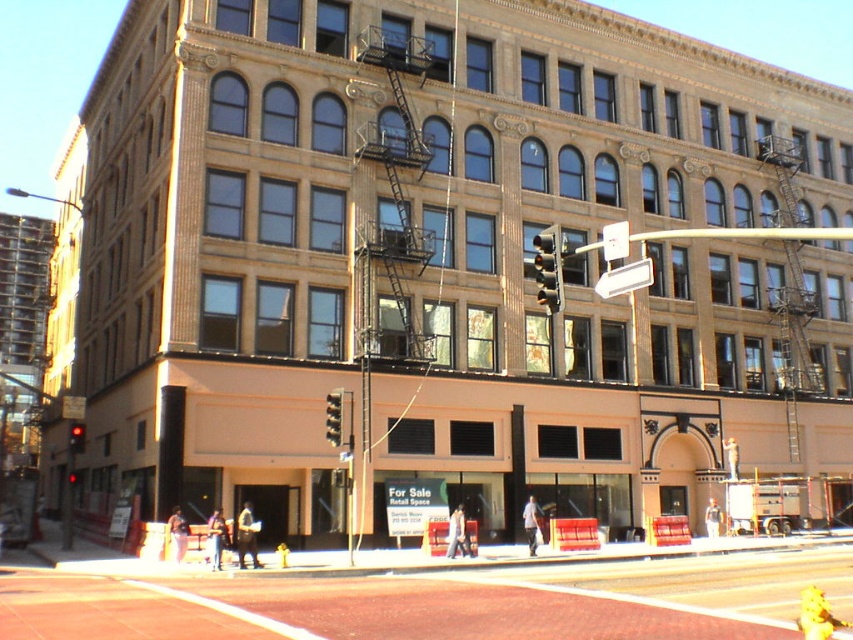
Is metallic glass traffic light at center below white plastic street sign at upper center?

Incorrect, metallic glass traffic light at center is not positioned below white plastic street sign at upper center.

At what (x,y) coordinates should I click in order to perform the action: click on metallic glass traffic light at center. Please return your answer as a coordinate pair (x, y). The width and height of the screenshot is (853, 640). Looking at the image, I should click on (548, 268).

Where is `metallic glass traffic light at center`? The width and height of the screenshot is (853, 640). metallic glass traffic light at center is located at coordinates (548, 268).

Does white plastic street sign at upper center appear on the right side of red glass traffic light at center?

Indeed, white plastic street sign at upper center is positioned on the right side of red glass traffic light at center.

Between point (637, 285) and point (80, 444), which one is positioned in front?

Point (637, 285)

Image resolution: width=853 pixels, height=640 pixels. I want to click on white plastic street sign at upper center, so click(x=625, y=278).

Is white plastic street sign at upper center taller than metallic traffic light at center?

Indeed, white plastic street sign at upper center has a greater height compared to metallic traffic light at center.

Between white plastic street sign at upper center and metallic traffic light at center, which one appears on the left side from the viewer's perspective?

From the viewer's perspective, metallic traffic light at center appears more on the left side.

Locate an element on the screen. white plastic street sign at upper center is located at coordinates (625, 278).